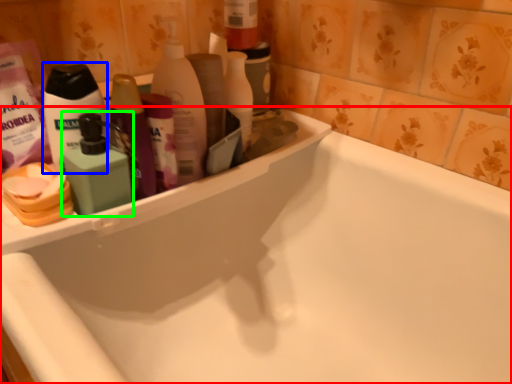
Question: Which object is positioned farthest from bathtub (highlighted by a red box)? Select from toiletry (highlighted by a blue box) and cleaning product (highlighted by a green box).

Choices:
 (A) toiletry
 (B) cleaning product

Answer: (A)